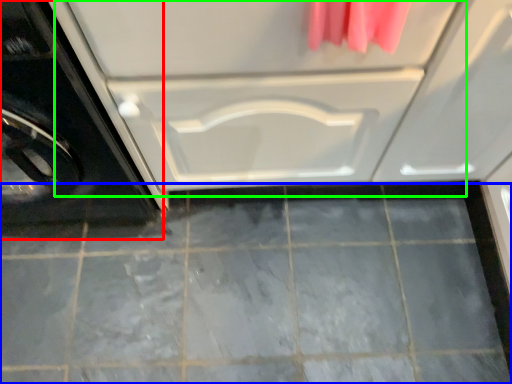
Question: Which object is the closest to the washing machine (highlighted by a red box)? Choose among these: ceramic tile (highlighted by a blue box) or drawer (highlighted by a green box).

Choices:
 (A) ceramic tile
 (B) drawer

Answer: (B)